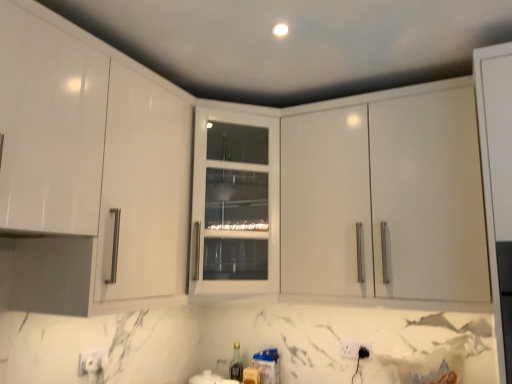
Find the location of a particular element. This screenshot has width=512, height=384. white glass cabinet at center, arranged as the first cabinetry when viewed from the left is located at coordinates (234, 203).

Where is `glossy white cabinet at upper right, which ranks as the second cabinetry in left-to-right order`? The width and height of the screenshot is (512, 384). glossy white cabinet at upper right, which ranks as the second cabinetry in left-to-right order is located at coordinates (385, 198).

From a real-world perspective, relative to white glass cabinet at center, the 2th cabinetry in the right-to-left sequence, is glossy white cabinet at upper right, which ranks as the second cabinetry in left-to-right order, vertically above or below?

From a real-world perspective, glossy white cabinet at upper right, which ranks as the second cabinetry in left-to-right order, is physically below white glass cabinet at center, the 2th cabinetry in the right-to-left sequence.

Is glossy white cabinet at upper right, which ranks as the second cabinetry in left-to-right order, placed right next to white glass cabinet at center, the 2th cabinetry in the right-to-left sequence?

No.

Can you confirm if glossy white cabinet at upper right, marked as the first cabinetry in a right-to-left arrangement, is smaller than white glass cabinet at center, arranged as the first cabinetry when viewed from the left?

No.

Is glossy white cabinet at upper right, which ranks as the second cabinetry in left-to-right order, positioned behind white glass cabinet at center, arranged as the first cabinetry when viewed from the left?

No, it is not.

Who is bigger, white glass cabinet at center, arranged as the first cabinetry when viewed from the left, or white plastic electric outlet at lower center, which is the 1th electric outlet from back to front?

Bigger between the two is white glass cabinet at center, arranged as the first cabinetry when viewed from the left.

Which object is further away from the camera taking this photo, white glass cabinet at center, arranged as the first cabinetry when viewed from the left, or white plastic electric outlet at lower center, which is the 1th electric outlet from back to front?

white plastic electric outlet at lower center, which is the 1th electric outlet from back to front.

From a real-world perspective, is white glass cabinet at center, arranged as the first cabinetry when viewed from the left, physically above white plastic electric outlet at lower center, which is the second electric outlet from front to back?

Yes, from a real-world perspective, white glass cabinet at center, arranged as the first cabinetry when viewed from the left, is above white plastic electric outlet at lower center, which is the second electric outlet from front to back.

Considering the relative positions of white glass cabinet at center, the 2th cabinetry in the right-to-left sequence, and white plastic electric outlet at lower center, arranged as the first electric outlet when viewed from the front, in the image provided, is white glass cabinet at center, the 2th cabinetry in the right-to-left sequence, in front of white plastic electric outlet at lower center, arranged as the first electric outlet when viewed from the front,?

Yes, the depth of white glass cabinet at center, the 2th cabinetry in the right-to-left sequence, is less than that of white plastic electric outlet at lower center, arranged as the first electric outlet when viewed from the front.

Which of these two, white glass cabinet at center, the 2th cabinetry in the right-to-left sequence, or white plastic electric outlet at lower center, acting as the 2th electric outlet starting from the back, stands shorter?

white plastic electric outlet at lower center, acting as the 2th electric outlet starting from the back, is shorter.

Is white glass cabinet at center, the 2th cabinetry in the right-to-left sequence, facing away from white plastic electric outlet at lower center, arranged as the first electric outlet when viewed from the front?

white glass cabinet at center, the 2th cabinetry in the right-to-left sequence, does not have its back to white plastic electric outlet at lower center, arranged as the first electric outlet when viewed from the front.

How much distance is there between white glass cabinet at center, arranged as the first cabinetry when viewed from the left, and white plastic electric outlet at lower center, acting as the 2th electric outlet starting from the back?

white glass cabinet at center, arranged as the first cabinetry when viewed from the left, is 36.73 inches away from white plastic electric outlet at lower center, acting as the 2th electric outlet starting from the back.

Are white plastic electric outlet at lower center, acting as the 2th electric outlet starting from the back, and glossy white cabinet at upper right, which ranks as the second cabinetry in left-to-right order, making contact?

No, white plastic electric outlet at lower center, acting as the 2th electric outlet starting from the back, is not touching glossy white cabinet at upper right, which ranks as the second cabinetry in left-to-right order.

How different are the orientations of white plastic electric outlet at lower center, arranged as the first electric outlet when viewed from the front, and glossy white cabinet at upper right, marked as the first cabinetry in a right-to-left arrangement, in degrees?

They differ by 1.36 degrees in their facing directions.

Relative to glossy white cabinet at upper right, which ranks as the second cabinetry in left-to-right order, is white plastic electric outlet at lower center, arranged as the first electric outlet when viewed from the front, in front or behind?

Visually, white plastic electric outlet at lower center, arranged as the first electric outlet when viewed from the front, is located behind glossy white cabinet at upper right, which ranks as the second cabinetry in left-to-right order.

From the image's perspective, is white plastic electric outlet at lower center, acting as the 2th electric outlet starting from the back, located beneath glossy white cabinet at upper right, which ranks as the second cabinetry in left-to-right order?

Indeed, from the image's perspective, white plastic electric outlet at lower center, acting as the 2th electric outlet starting from the back, is shown beneath glossy white cabinet at upper right, which ranks as the second cabinetry in left-to-right order.

How many degrees apart are the facing directions of white plastic electric outlet at lower center, which is the 1th electric outlet from back to front, and white plastic electric outlet at lower center, arranged as the first electric outlet when viewed from the front?

There is a 1.7-degree angle between the facing directions of white plastic electric outlet at lower center, which is the 1th electric outlet from back to front, and white plastic electric outlet at lower center, arranged as the first electric outlet when viewed from the front.

Considering the sizes of white plastic electric outlet at lower center, which is the 1th electric outlet from back to front, and white plastic electric outlet at lower center, acting as the 2th electric outlet starting from the back, in the image, is white plastic electric outlet at lower center, which is the 1th electric outlet from back to front, bigger or smaller than white plastic electric outlet at lower center, acting as the 2th electric outlet starting from the back,?

In the image, white plastic electric outlet at lower center, which is the 1th electric outlet from back to front, appears to be larger than white plastic electric outlet at lower center, acting as the 2th electric outlet starting from the back.

Is white plastic electric outlet at lower center, which is the 1th electric outlet from back to front, with white plastic electric outlet at lower center, arranged as the first electric outlet when viewed from the front?

Yes, white plastic electric outlet at lower center, which is the 1th electric outlet from back to front, is right next to white plastic electric outlet at lower center, arranged as the first electric outlet when viewed from the front, and making contact.

How distant is white plastic electric outlet at lower center, which is the second electric outlet from front to back, from white plastic electric outlet at lower center, acting as the 2th electric outlet starting from the back?

white plastic electric outlet at lower center, which is the second electric outlet from front to back, and white plastic electric outlet at lower center, acting as the 2th electric outlet starting from the back, are 1.36 inches apart.

From the image's perspective, which object appears higher, white plastic electric outlet at lower center, which is the second electric outlet from front to back, or glossy white cabinet at upper right, which ranks as the second cabinetry in left-to-right order?

glossy white cabinet at upper right, which ranks as the second cabinetry in left-to-right order, from the image's perspective.

In terms of size, does white plastic electric outlet at lower center, which is the second electric outlet from front to back, appear bigger or smaller than glossy white cabinet at upper right, which ranks as the second cabinetry in left-to-right order?

Clearly, white plastic electric outlet at lower center, which is the second electric outlet from front to back, is smaller in size than glossy white cabinet at upper right, which ranks as the second cabinetry in left-to-right order.

Starting from the glossy white cabinet at upper right, which ranks as the second cabinetry in left-to-right order, which electric outlet is the 2nd one to the left? Please provide its 2D coordinates.

[(354, 349)]

Based on their positions, is white plastic electric outlet at lower center, which is the second electric outlet from front to back, located to the left or right of glossy white cabinet at upper right, marked as the first cabinetry in a right-to-left arrangement?

From the image, it's evident that white plastic electric outlet at lower center, which is the second electric outlet from front to back, is to the left of glossy white cabinet at upper right, marked as the first cabinetry in a right-to-left arrangement.

Is white glass cabinet at center, the 2th cabinetry in the right-to-left sequence, turned away from glossy white cabinet at upper right, marked as the first cabinetry in a right-to-left arrangement?

No, white glass cabinet at center, the 2th cabinetry in the right-to-left sequence, is not facing the opposite direction of glossy white cabinet at upper right, marked as the first cabinetry in a right-to-left arrangement.

Can you confirm if white glass cabinet at center, the 2th cabinetry in the right-to-left sequence, is shorter than glossy white cabinet at upper right, marked as the first cabinetry in a right-to-left arrangement?

Indeed, white glass cabinet at center, the 2th cabinetry in the right-to-left sequence, has a lesser height compared to glossy white cabinet at upper right, marked as the first cabinetry in a right-to-left arrangement.

Do you think white glass cabinet at center, the 2th cabinetry in the right-to-left sequence, is within glossy white cabinet at upper right, marked as the first cabinetry in a right-to-left arrangement, or outside of it?

white glass cabinet at center, the 2th cabinetry in the right-to-left sequence, is not inside glossy white cabinet at upper right, marked as the first cabinetry in a right-to-left arrangement, it's outside.

Based on the photo, is white glass cabinet at center, the 2th cabinetry in the right-to-left sequence, at the left side of glossy white cabinet at upper right, marked as the first cabinetry in a right-to-left arrangement?

Yes.

At what (x,y) coordinates should I click in order to perform the action: click on cabinetry above the glossy white cabinet at upper right, which ranks as the second cabinetry in left-to-right order (from a real-world perspective). Please return your answer as a coordinate pair (x, y). Image resolution: width=512 pixels, height=384 pixels. Looking at the image, I should click on (234, 203).

From the image's perspective, count 1st cabinetrys upward from the white plastic electric outlet at lower center, which is the second electric outlet from front to back, and point to it. Please provide its 2D coordinates.

[(234, 203)]

Looking at the image, which one is located closer to white glass cabinet at center, the 2th cabinetry in the right-to-left sequence, white plastic electric outlet at lower center, which is the second electric outlet from front to back, or white plastic electric outlet at lower center, arranged as the first electric outlet when viewed from the front?

white plastic electric outlet at lower center, which is the second electric outlet from front to back, lies closer to white glass cabinet at center, the 2th cabinetry in the right-to-left sequence, than the other object.

Considering their positions, is white plastic electric outlet at lower center, which is the 1th electric outlet from back to front, positioned further to white glass cabinet at center, the 2th cabinetry in the right-to-left sequence, than glossy white cabinet at upper right, which ranks as the second cabinetry in left-to-right order?

white plastic electric outlet at lower center, which is the 1th electric outlet from back to front.

Estimate the real-world distances between objects in this image. Which object is closer to white plastic electric outlet at lower center, arranged as the first electric outlet when viewed from the front, glossy white cabinet at upper right, which ranks as the second cabinetry in left-to-right order, or white glass cabinet at center, arranged as the first cabinetry when viewed from the left?

glossy white cabinet at upper right, which ranks as the second cabinetry in left-to-right order, lies closer to white plastic electric outlet at lower center, arranged as the first electric outlet when viewed from the front, than the other object.

From the image, which object appears to be nearer to white plastic electric outlet at lower center, arranged as the first electric outlet when viewed from the front, white plastic electric outlet at lower center, which is the 1th electric outlet from back to front, or glossy white cabinet at upper right, which ranks as the second cabinetry in left-to-right order?

white plastic electric outlet at lower center, which is the 1th electric outlet from back to front.

Estimate the real-world distances between objects in this image. Which object is closer to white plastic electric outlet at lower center, which is the 1th electric outlet from back to front, white glass cabinet at center, the 2th cabinetry in the right-to-left sequence, or glossy white cabinet at upper right, marked as the first cabinetry in a right-to-left arrangement?

glossy white cabinet at upper right, marked as the first cabinetry in a right-to-left arrangement, is closer to white plastic electric outlet at lower center, which is the 1th electric outlet from back to front.

Considering their positions, is glossy white cabinet at upper right, which ranks as the second cabinetry in left-to-right order, positioned closer to white glass cabinet at center, arranged as the first cabinetry when viewed from the left, than white plastic electric outlet at lower center, which is the second electric outlet from front to back?

glossy white cabinet at upper right, which ranks as the second cabinetry in left-to-right order, is positioned closer to the anchor white glass cabinet at center, arranged as the first cabinetry when viewed from the left.

Based on their spatial positions, is glossy white cabinet at upper right, marked as the first cabinetry in a right-to-left arrangement, or white plastic electric outlet at lower center, which is the 1th electric outlet from back to front, further from white plastic electric outlet at lower center, arranged as the first electric outlet when viewed from the front?

glossy white cabinet at upper right, marked as the first cabinetry in a right-to-left arrangement.

In the scene shown: Based on their spatial positions, is white plastic electric outlet at lower center, arranged as the first electric outlet when viewed from the front, or white glass cabinet at center, the 2th cabinetry in the right-to-left sequence, closer to glossy white cabinet at upper right, which ranks as the second cabinetry in left-to-right order?

The object closer to glossy white cabinet at upper right, which ranks as the second cabinetry in left-to-right order, is white glass cabinet at center, the 2th cabinetry in the right-to-left sequence.

Locate an element on the screen. This screenshot has width=512, height=384. cabinetry between glossy white cabinet at upper right, marked as the first cabinetry in a right-to-left arrangement, and white plastic electric outlet at lower center, acting as the 2th electric outlet starting from the back, vertically is located at coordinates (234, 203).

Image resolution: width=512 pixels, height=384 pixels. What are the coordinates of `cabinetry between glossy white cabinet at upper right, which ranks as the second cabinetry in left-to-right order, and white plastic electric outlet at lower center, which is the 1th electric outlet from back to front, from top to bottom` in the screenshot? It's located at (234, 203).

You are a GUI agent. You are given a task and a screenshot of the screen. Output one action in this format:
    pyautogui.click(x=<x>, y=<y>)
    Task: Click on the electric outlet between white glass cabinet at center, the 2th cabinetry in the right-to-left sequence, and white plastic electric outlet at lower center, which is the second electric outlet from front to back, in the up-down direction
    This screenshot has height=384, width=512.
    Given the screenshot: What is the action you would take?
    pyautogui.click(x=362, y=352)

The height and width of the screenshot is (384, 512). What are the coordinates of `electric outlet between glossy white cabinet at upper right, which ranks as the second cabinetry in left-to-right order, and white plastic electric outlet at lower center, which is the second electric outlet from front to back, in the up-down direction` in the screenshot? It's located at (362, 352).